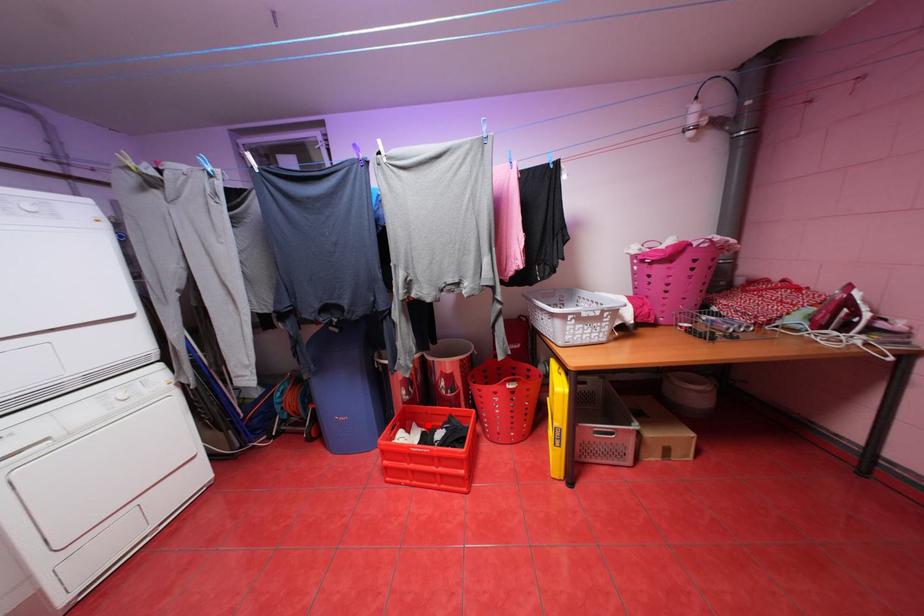
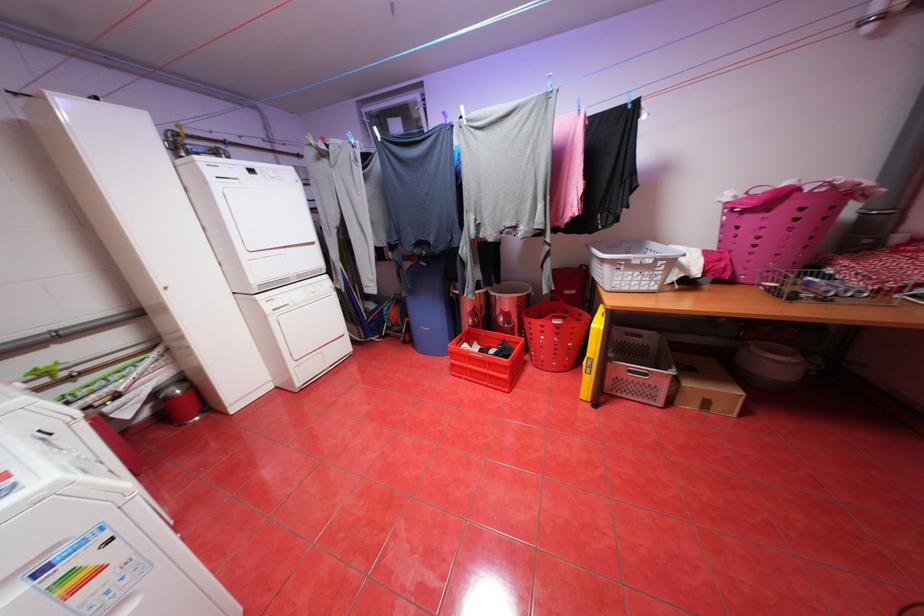
Question: I am providing you with two images of the same scene from different viewpoints. Given a red point in image1, look at the same physical point in image2. Is it:

Choices:
 (A) Closer to the viewpoint
 (B) Farther from the viewpoint

Answer: (A)